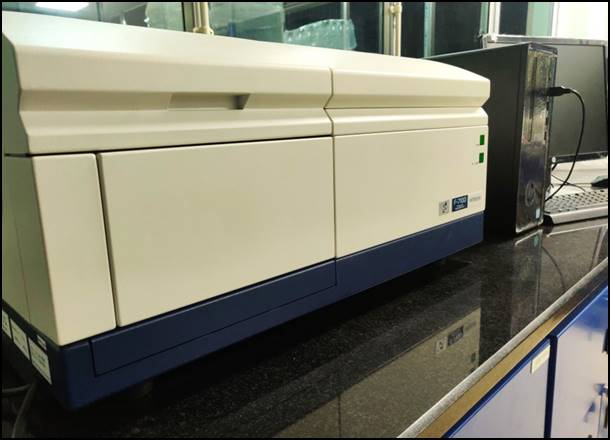
Find the location of a particular element. The image size is (610, 440). handle is located at coordinates (202, 98).